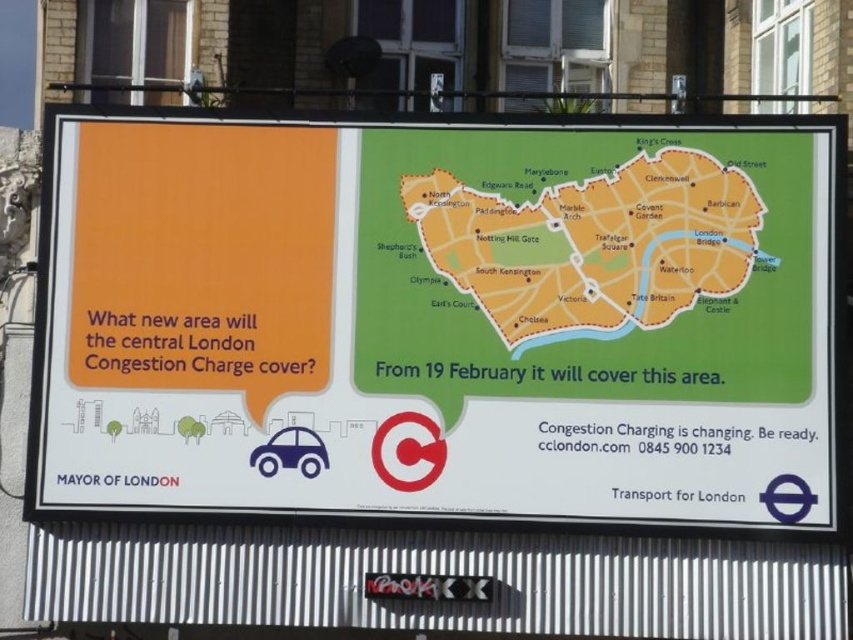
Does white paper map at upper center have a lesser height compared to orange paper map at center?

Incorrect, white paper map at upper center's height does not fall short of orange paper map at center's.

Who is more forward, [405,289] or [572,300]?

Point [572,300] is in front.

You are a GUI agent. You are given a task and a screenshot of the screen. Output one action in this format:
    pyautogui.click(x=<x>, y=<y>)
    Task: Click on the white paper map at upper center
    The height and width of the screenshot is (640, 853).
    Given the screenshot: What is the action you would take?
    pyautogui.click(x=437, y=320)